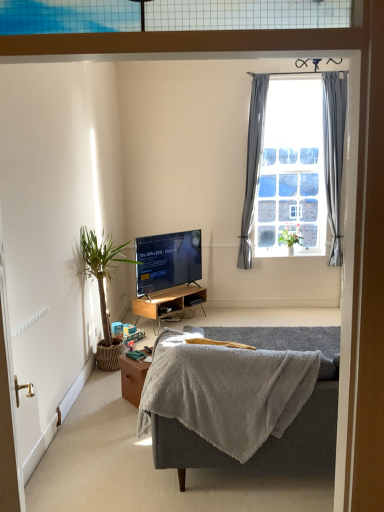
What do you see at coordinates (334, 152) in the screenshot?
I see `gray fabric curtain at upper right, which is counted as the second curtain, starting from the left` at bounding box center [334, 152].

The height and width of the screenshot is (512, 384). What do you see at coordinates (167, 261) in the screenshot?
I see `matte black tv at center` at bounding box center [167, 261].

What do you see at coordinates (103, 288) in the screenshot?
I see `green leafy plant at left, the 2th houseplant viewed from the right` at bounding box center [103, 288].

This screenshot has height=512, width=384. Describe the element at coordinates (289, 239) in the screenshot. I see `green leafy plant at window, positioned as the first houseplant in back-to-front order` at that location.

Locate an element on the screen. green leafy plant at window, which is the 2th houseplant from left to right is located at coordinates (289, 239).

The width and height of the screenshot is (384, 512). I want to click on gray fabric curtain at right, which ranks as the first curtain in left-to-right order, so 253,164.

Locate an element on the screen. television in front of the gray fabric curtain at upper right, the 1th curtain positioned from the right is located at coordinates (167, 261).

Is the surface of matte black tv at center in direct contact with gray fabric curtain at upper right, the 1th curtain positioned from the right?

matte black tv at center and gray fabric curtain at upper right, the 1th curtain positioned from the right, are not in contact.

Relative to gray fabric curtain at upper right, which is counted as the second curtain, starting from the left, is matte black tv at center in front or behind?

matte black tv at center is in front of gray fabric curtain at upper right, which is counted as the second curtain, starting from the left.

Is gray fabric curtain at right, which appears as the second curtain when viewed from the right, in front of or behind matte black tv at center in the image?

gray fabric curtain at right, which appears as the second curtain when viewed from the right, is behind matte black tv at center.

Is gray fabric curtain at right, which ranks as the first curtain in left-to-right order, next to matte black tv at center?

There is a gap between gray fabric curtain at right, which ranks as the first curtain in left-to-right order, and matte black tv at center.

Can you confirm if gray fabric curtain at right, which ranks as the first curtain in left-to-right order, is wider than matte black tv at center?

In fact, gray fabric curtain at right, which ranks as the first curtain in left-to-right order, might be narrower than matte black tv at center.

In order to click on television in front of the gray fabric curtain at right, which appears as the second curtain when viewed from the right in this screenshot , I will do `click(167, 261)`.

In the scene shown: Would you say gray plush couch at center is inside or outside green leafy plant at window, the first houseplant when ordered from right to left?

gray plush couch at center is outside green leafy plant at window, the first houseplant when ordered from right to left.

In the image, is gray plush couch at center positioned in front of or behind green leafy plant at window, which is the 2th houseplant from left to right?

gray plush couch at center is in front of green leafy plant at window, which is the 2th houseplant from left to right.

From the image's perspective, which object appears higher, gray plush couch at center or green leafy plant at window, positioned as the first houseplant in back-to-front order?

green leafy plant at window, positioned as the first houseplant in back-to-front order, is shown above in the image.

Is point (319, 410) in front of point (281, 236)?

Yes, point (319, 410) is in front of point (281, 236).

Which is more to the left, green leafy plant at window, which is the 2th houseplant from left to right, or matte black tv at center?

From the viewer's perspective, matte black tv at center appears more on the left side.

Based on the photo, which is nearer, (279, 240) or (187, 234)?

Point (187, 234)

Is green leafy plant at window, the second houseplant when ordered from front to back, smaller than matte black tv at center?

Yes, green leafy plant at window, the second houseplant when ordered from front to back, is smaller than matte black tv at center.

From the image's perspective, between green leafy plant at window, the first houseplant when ordered from right to left, and matte black tv at center, who is located below?

matte black tv at center appears lower in the image.

Which of these two, green leafy plant at left, which ranks as the first houseplant in left-to-right order, or green leafy plant at window, which is the 2th houseplant from left to right, stands taller?

green leafy plant at left, which ranks as the first houseplant in left-to-right order.

Can we say green leafy plant at left, positioned as the 2th houseplant in back-to-front order, lies outside green leafy plant at window, the second houseplant when ordered from front to back?

Yes.

Consider the image. Does green leafy plant at left, the 2th houseplant viewed from the right, have a smaller size compared to green leafy plant at window, positioned as the first houseplant in back-to-front order?

No, green leafy plant at left, the 2th houseplant viewed from the right, is not smaller than green leafy plant at window, positioned as the first houseplant in back-to-front order.

Is matte black tv at center thinner than green leafy plant at left, which ranks as the first houseplant in left-to-right order?

Indeed, matte black tv at center has a lesser width compared to green leafy plant at left, which ranks as the first houseplant in left-to-right order.

Can you tell me how much matte black tv at center and green leafy plant at left, positioned as the 2th houseplant in back-to-front order, differ in facing direction?

The angle between the facing direction of matte black tv at center and the facing direction of green leafy plant at left, positioned as the 2th houseplant in back-to-front order, is 39.6 degrees.

From the image's perspective, is matte black tv at center located beneath green leafy plant at left, which ranks as the first houseplant in left-to-right order?

No, from the image's perspective, matte black tv at center is not beneath green leafy plant at left, which ranks as the first houseplant in left-to-right order.

Based on the photo, considering the relative positions of matte black tv at center and green leafy plant at left, which ranks as the first houseplant in left-to-right order, in the image provided, is matte black tv at center to the left or to the right of green leafy plant at left, which ranks as the first houseplant in left-to-right order,?

In the image, matte black tv at center appears on the right side of green leafy plant at left, which ranks as the first houseplant in left-to-right order.

Could you tell me if green leafy plant at window, which is the 2th houseplant from left to right, is facing clear glass window at upper right?

No, green leafy plant at window, which is the 2th houseplant from left to right, is not oriented towards clear glass window at upper right.

Are green leafy plant at window, positioned as the first houseplant in back-to-front order, and clear glass window at upper right far apart?

green leafy plant at window, positioned as the first houseplant in back-to-front order, is actually quite close to clear glass window at upper right.

From the image's perspective, does green leafy plant at window, which is the 2th houseplant from left to right, appear lower than clear glass window at upper right?

Yes, from the image's perspective, green leafy plant at window, which is the 2th houseplant from left to right, is beneath clear glass window at upper right.

Is green leafy plant at window, the second houseplant when ordered from front to back, at the left side of clear glass window at upper right?

No.

Find the location of `curtain that is the 2nd object to the right of the matte black tv at center, starting at the anchor`. curtain that is the 2nd object to the right of the matte black tv at center, starting at the anchor is located at coordinates (334, 152).

Locate an element on the screen. television below the gray fabric curtain at right, which appears as the second curtain when viewed from the right (from a real-world perspective) is located at coordinates (167, 261).

From the image, which object appears to be nearer to woodenmaterial/texturedesk at center, matte black tv at center or clear glass window at upper right?

Based on the image, matte black tv at center appears to be nearer to woodenmaterial/texturedesk at center.

Estimate the real-world distances between objects in this image. Which object is closer to green leafy plant at left, which appears as the 1th houseplant when viewed from the front, woodenmaterial/texturedesk at center or matte black tv at center?

matte black tv at center lies closer to green leafy plant at left, which appears as the 1th houseplant when viewed from the front, than the other object.

Looking at the image, which one is located further to gray fabric curtain at upper right, which is counted as the second curtain, starting from the left, matte black tv at center or woodenmaterial/texturedesk at center?

woodenmaterial/texturedesk at center is further to gray fabric curtain at upper right, which is counted as the second curtain, starting from the left.

Based on their spatial positions, is gray fabric curtain at upper right, which is counted as the second curtain, starting from the left, or brown wooden table at lower center closer to gray plush couch at center?

Among the two, brown wooden table at lower center is located nearer to gray plush couch at center.

Considering their positions, is gray plush couch at center positioned closer to matte black tv at center than brown wooden table at lower center?

Based on the image, gray plush couch at center appears to be nearer to matte black tv at center.

Looking at this image, looking at the image, which one is located further to green leafy plant at window, which is the 2th houseplant from left to right, clear glass window at upper right or gray fabric curtain at upper right, the 1th curtain positioned from the right?

The object further to green leafy plant at window, which is the 2th houseplant from left to right, is gray fabric curtain at upper right, the 1th curtain positioned from the right.

Which object lies further to the anchor point gray plush couch at center, matte black tv at center or green leafy plant at window, which is the 2th houseplant from left to right?

Based on the image, green leafy plant at window, which is the 2th houseplant from left to right, appears to be further to gray plush couch at center.

From the image, which object appears to be farther from gray fabric curtain at right, which appears as the second curtain when viewed from the right, green leafy plant at window, the first houseplant when ordered from right to left, or gray fabric curtain at upper right, the 1th curtain positioned from the right?

gray fabric curtain at upper right, the 1th curtain positioned from the right, lies further to gray fabric curtain at right, which appears as the second curtain when viewed from the right, than the other object.

Find the location of a particular element. houseplant between green leafy plant at left, which ranks as the first houseplant in left-to-right order, and gray fabric curtain at upper right, which is counted as the second curtain, starting from the left, from left to right is located at coordinates (289, 239).

Where is `houseplant between brown wooden table at lower center and gray fabric curtain at right, which ranks as the first curtain in left-to-right order, along the z-axis`? The height and width of the screenshot is (512, 384). houseplant between brown wooden table at lower center and gray fabric curtain at right, which ranks as the first curtain in left-to-right order, along the z-axis is located at coordinates (103, 288).

You are a GUI agent. You are given a task and a screenshot of the screen. Output one action in this format:
    pyautogui.click(x=<x>, y=<y>)
    Task: Click on the bay window between gray plush couch at center and green leafy plant at window, the first houseplant when ordered from right to left, from front to back
    The height and width of the screenshot is (512, 384).
    Given the screenshot: What is the action you would take?
    pyautogui.click(x=290, y=198)

Where is `desk positioned between gray plush couch at center and clear glass window at upper right from near to far`? desk positioned between gray plush couch at center and clear glass window at upper right from near to far is located at coordinates (170, 303).